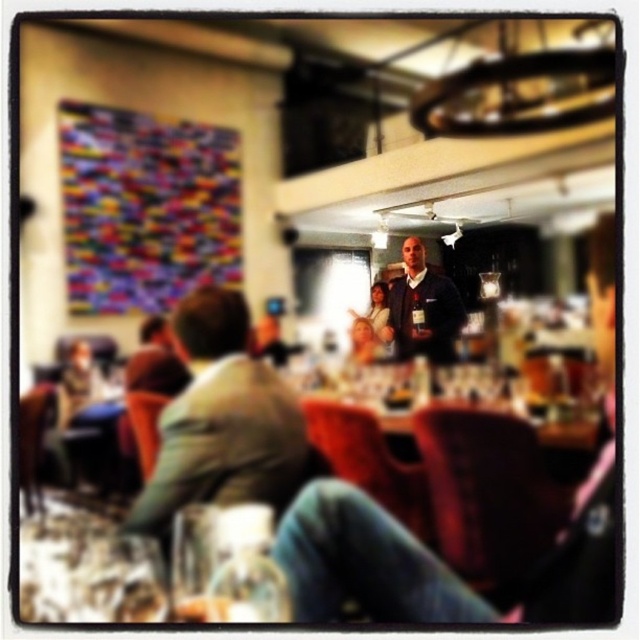
You are standing at the entrance of the venue and want to locate the green fabric jacket at center. According to the coordinates provided, in which direction should you look to find it?

The green fabric jacket at center is located at coordinates point (224,422), which means it is positioned towards the right and slightly above the center of the image. You should look to the right side of the image, slightly above the middle point to locate it.

You are standing at the point located at coordinate point (227, 417). You need to reach a friend who is at the other end of the room. The shortest path to them requires moving in a straight line. If the room is 3 meters wide, will you pass through the center of the room before reaching them?

Since you and your friend are 1.33 meters apart and the room is 3 meters wide, the straight path between you would not span the entire width of the room. Therefore, you would not pass through the center of the room before reaching them.

You are a photographer trying to capture a clear shot of the dark blue shirt at center and the clear glass at lower left. Since the scene is slightly blurred, you decide to adjust your focus. Which object should you focus on first if you want to ensure the taller object is in focus?

The dark blue shirt at center is taller than the clear glass at lower left, so you should focus on the dark blue shirt at center first to ensure it is in focus.